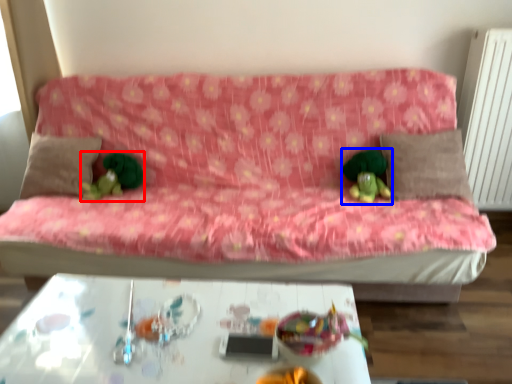
Question: Which of the following is the farthest to the observer, toy (highlighted by a red box) or miniature (highlighted by a blue box)?

Choices:
 (A) toy
 (B) miniature

Answer: (A)